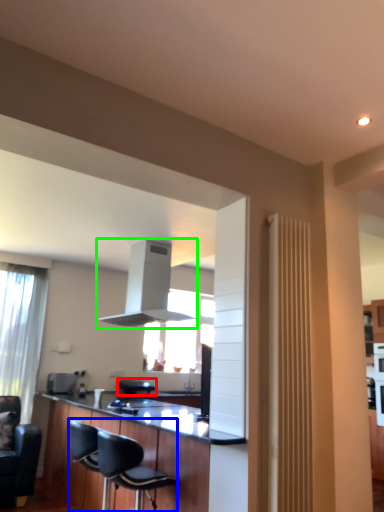
Question: Which is farther away from armchair (highlighted by a red box)? chair (highlighted by a blue box) or exhaust hood (highlighted by a green box)?

Choices:
 (A) chair
 (B) exhaust hood

Answer: (B)